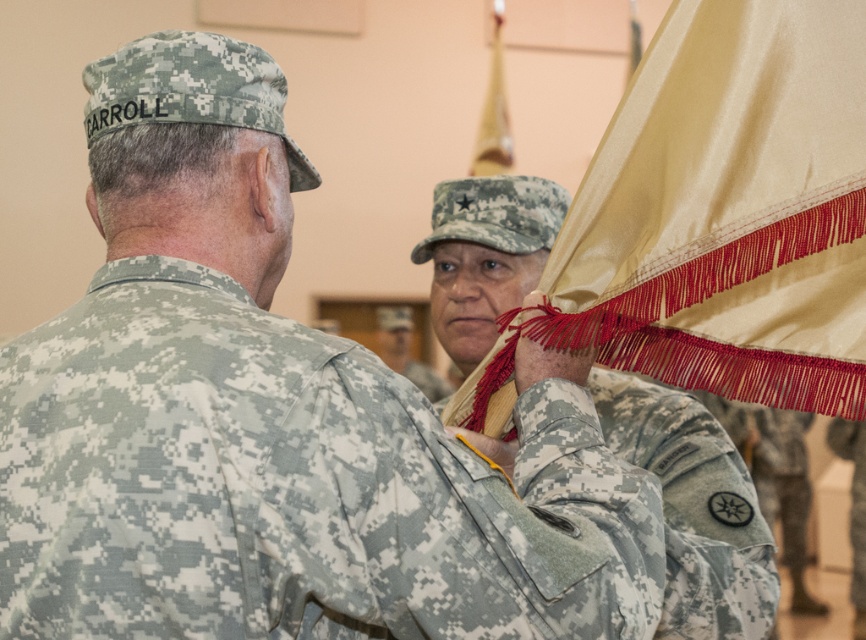
Between point (154, 502) and point (787, 244), which one is positioned behind?

The point (787, 244) is more distant.

The width and height of the screenshot is (866, 640). In order to click on camouflage fabric uniform at upper right in this screenshot , I will do `click(289, 486)`.

Which is behind, point (543, 621) or point (456, 218)?

The point (456, 218) is behind.

How far apart are camouflage fabric uniform at upper right and camouflage fabric flag at center?

A distance of 13.17 inches exists between camouflage fabric uniform at upper right and camouflage fabric flag at center.

Find the location of a particular element. camouflage fabric uniform at upper right is located at coordinates (289, 486).

Image resolution: width=866 pixels, height=640 pixels. I want to click on camouflage fabric uniform at upper right, so click(x=289, y=486).

Does camouflage fabric uniform at upper right appear on the left side of silky gold flag at upper center?

Correct, you'll find camouflage fabric uniform at upper right to the left of silky gold flag at upper center.

Does camouflage fabric uniform at upper right come behind silky gold flag at upper center?

No, it is not.

Where is `camouflage fabric uniform at upper right`? This screenshot has height=640, width=866. camouflage fabric uniform at upper right is located at coordinates (289, 486).